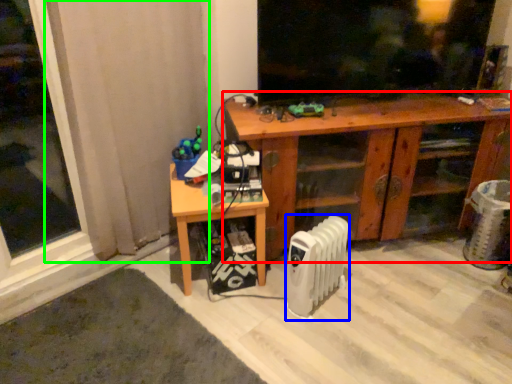
Question: Which object is the farthest from desk (highlighted by a red box)? Choose among these: radiator (highlighted by a blue box) or curtain (highlighted by a green box).

Choices:
 (A) radiator
 (B) curtain

Answer: (B)